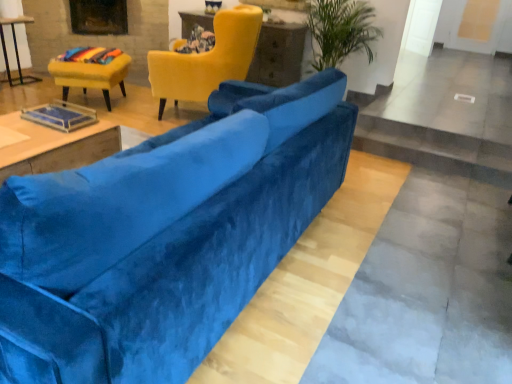
Question: Is velvet blue couch at center taller or shorter than rainbow fabric cushion at upper left?

Choices:
 (A) short
 (B) tall

Answer: (B)

Question: Is point (195, 256) positioned closer to the camera than point (94, 54)?

Choices:
 (A) farther
 (B) closer

Answer: (B)

Question: Based on their relative distances, which object is farther from the velvet blue couch at center?

Choices:
 (A) matte black table at left, positioned as the 2th table in bottom-to-top order
 (B) velvet yellow chair at upper left, which is counted as the 2th chair, starting from the right
 (C) matte yellow table at upper center, the first table in the top-to-bottom sequence
 (D) velvet yellow armchair at upper center, the 2th chair when ordered from left to right
 (E) dark brown wood fireplace at upper left

Answer: (A)

Question: Considering the real-world distances, which object is closest to the velvet yellow armchair at upper center, arranged as the first chair when viewed from the right?

Choices:
 (A) velvet blue couch at center
 (B) velvet yellow chair at upper left, which is the first chair in left-to-right order
 (C) dark brown wood fireplace at upper left
 (D) matte black table at left, which ranks as the 1th table in left-to-right order
 (E) wooden table at center, which ranks as the 2th table in right-to-left order

Answer: (B)